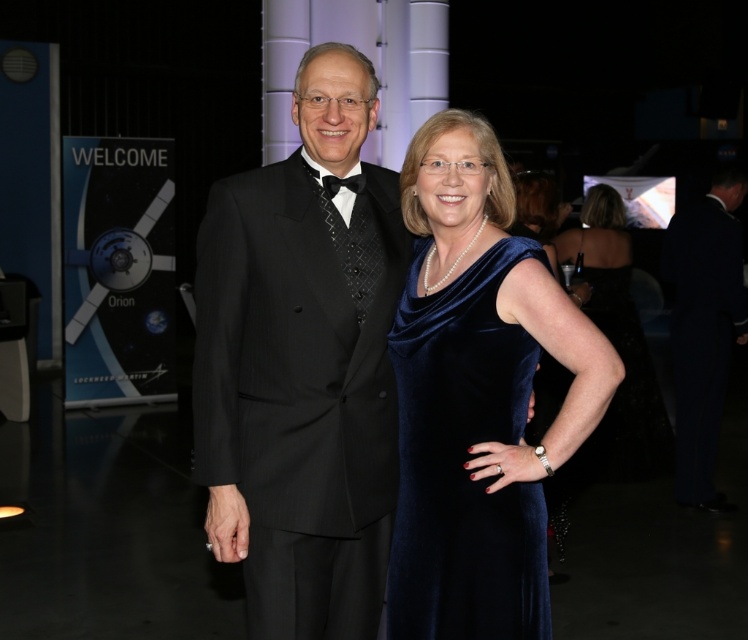
Is velvet blue dress at right smaller than velvet blue dress at center?

Indeed, velvet blue dress at right has a smaller size compared to velvet blue dress at center.

Which is above, velvet blue dress at right or velvet blue dress at center?

velvet blue dress at center is above.

Where is `velvet blue dress at right`? Image resolution: width=748 pixels, height=640 pixels. velvet blue dress at right is located at coordinates (462, 460).

Can you confirm if matte black tuxedo at center is positioned to the left of velvet blue dress at right?

Correct, you'll find matte black tuxedo at center to the left of velvet blue dress at right.

What do you see at coordinates (303, 364) in the screenshot? The image size is (748, 640). I see `matte black tuxedo at center` at bounding box center [303, 364].

Which is in front, point (349, 480) or point (419, 307)?

Positioned in front is point (419, 307).

Find the location of a particular element. Image resolution: width=748 pixels, height=640 pixels. matte black tuxedo at center is located at coordinates (303, 364).

Does matte black tuxedo at center appear on the right side of velvet blue dress at center?

No, matte black tuxedo at center is not to the right of velvet blue dress at center.

Between matte black tuxedo at center and velvet blue dress at center, which one has less height?

Standing shorter between the two is matte black tuxedo at center.

This screenshot has width=748, height=640. I want to click on matte black tuxedo at center, so click(x=303, y=364).